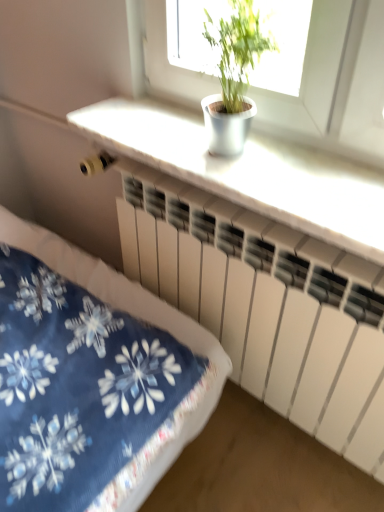
Image resolution: width=384 pixels, height=512 pixels. Find the location of `free space to the right of green leafy plant at upper center`. free space to the right of green leafy plant at upper center is located at coordinates (305, 170).